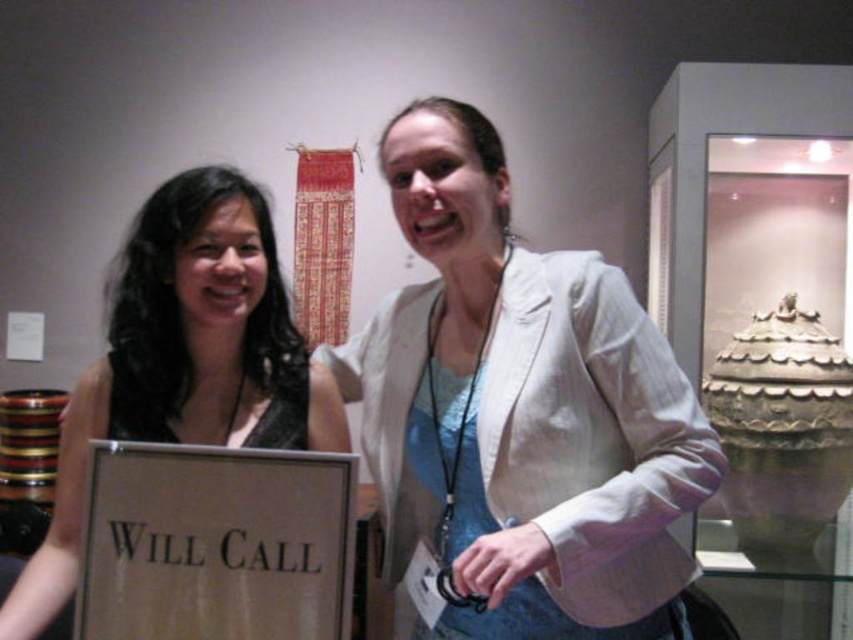
Does white textured blazer at center lie behind black satin dress at left?

No, white textured blazer at center is closer to the viewer.

Does white textured blazer at center appear over black satin dress at left?

Correct, white textured blazer at center is located above black satin dress at left.

Between point (451, 291) and point (270, 348), which one is positioned in front?

Point (451, 291) is in front.

Locate an element on the screen. white textured blazer at center is located at coordinates (521, 410).